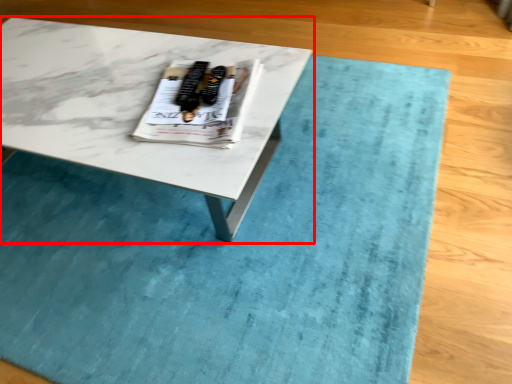
Question: Considering the relative positions of coffee table (annotated by the red box) and magazine in the image provided, where is coffee table (annotated by the red box) located with respect to the staircase?

Choices:
 (A) left
 (B) right

Answer: (A)